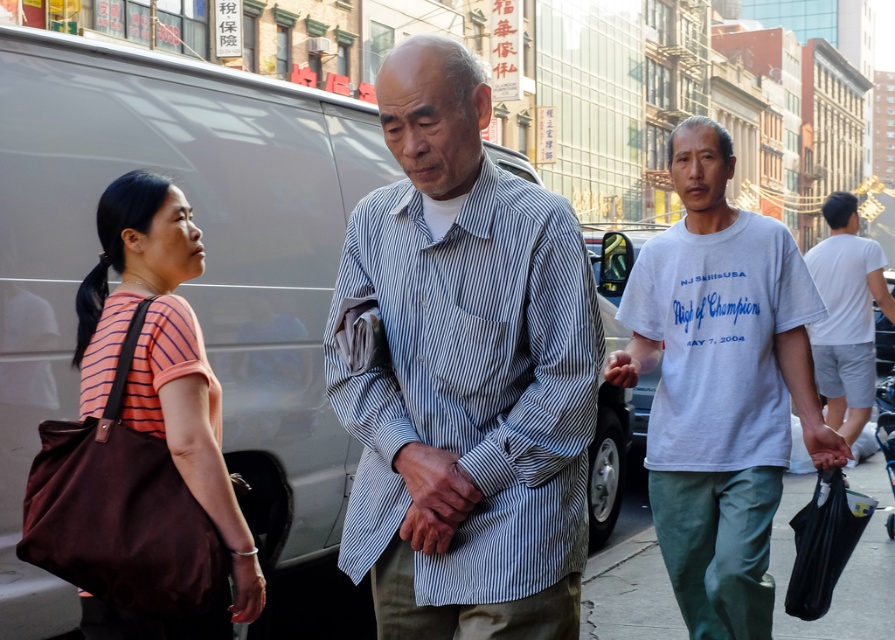
You are standing at the point marked by the coordinate point at (467, 76). The woman in the orange and pink striped shirt is walking away from you. Is she moving towards or away from the older man standing at the center?

The woman in the orange and pink striped shirt is walking away from you, and since you are at the point marked by the coordinate point at (467, 76), which is 6.97 feet away from the older man, her movement direction relative to the older man depends on their positions. However, the description states they are 6.97 feet apart, but without knowing the exact direction of her movement relative to his position, we cannot definitively determine if she is moving toward or away from him. The information provided